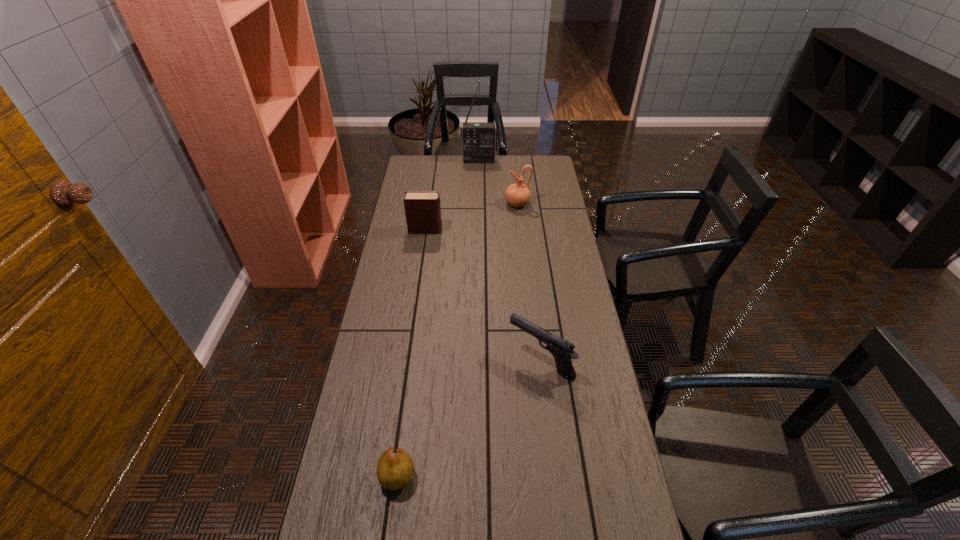
Image resolution: width=960 pixels, height=540 pixels. I want to click on object that ranks as the second closest to the pottery, so click(479, 140).

Find the location of a particular element. The image size is (960, 540). object that is the closest one to the farthest object is located at coordinates (517, 195).

You are a GUI agent. You are given a task and a screenshot of the screen. Output one action in this format:
    pyautogui.click(x=<x>, y=<y>)
    Task: Click on the vacant position in the image that satisfies the following two spatial constraints: 1. on the display of the third object from right to left; 2. on the spine side of the diary
    
    Given the screenshot: What is the action you would take?
    pyautogui.click(x=479, y=230)

You are a GUI agent. You are given a task and a screenshot of the screen. Output one action in this format:
    pyautogui.click(x=<x>, y=<y>)
    Task: Click on the free location that satisfies the following two spatial constraints: 1. on the spine side of the diary; 2. on the left side of the shortest object
    This screenshot has width=960, height=540.
    Given the screenshot: What is the action you would take?
    pyautogui.click(x=391, y=476)

The height and width of the screenshot is (540, 960). What are the coordinates of `vacant region that satisfies the following two spatial constraints: 1. on the spine side of the third farthest object; 2. on the left side of the pear` in the screenshot? It's located at (391, 476).